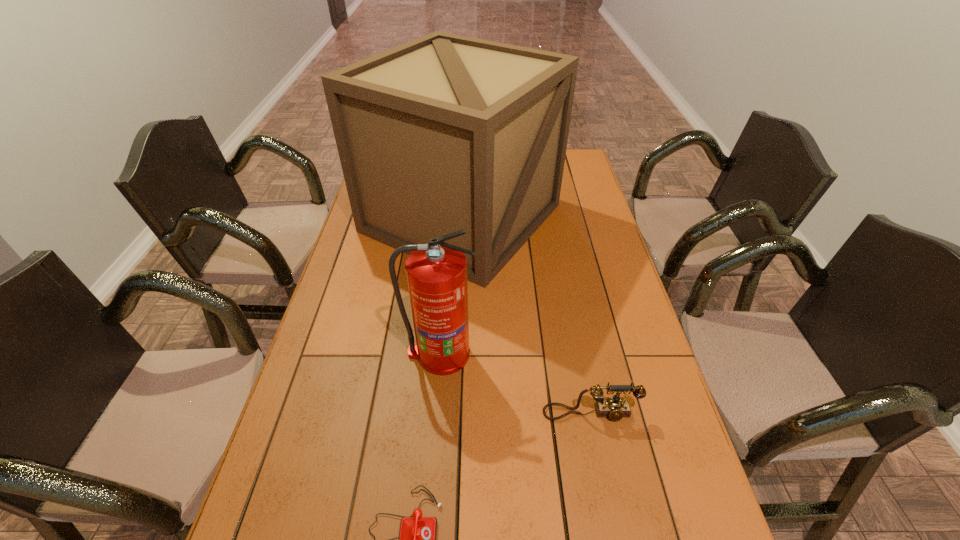
Where is `box`? The image size is (960, 540). box is located at coordinates (446, 132).

Image resolution: width=960 pixels, height=540 pixels. I want to click on the farthest object, so click(x=446, y=132).

Locate an element on the screen. the second tallest object is located at coordinates (436, 272).

Locate an element on the screen. Image resolution: width=960 pixels, height=540 pixels. the second farthest object is located at coordinates (436, 272).

Where is `the second nearest object`? The width and height of the screenshot is (960, 540). the second nearest object is located at coordinates (614, 408).

I want to click on the taller telephone, so [614, 408].

The image size is (960, 540). What are the coordinates of `vacant space located 0.090m on the back of the tallest object` in the screenshot? It's located at (465, 158).

Where is `vacant region located on the instruction side of the fire extinguisher`? vacant region located on the instruction side of the fire extinguisher is located at coordinates (434, 423).

This screenshot has height=540, width=960. Find the location of `free space located 0.140m on the front-facing side of the farther telephone`. free space located 0.140m on the front-facing side of the farther telephone is located at coordinates coord(605,484).

Locate an element on the screen. This screenshot has height=540, width=960. object positioned at the far edge is located at coordinates (446, 132).